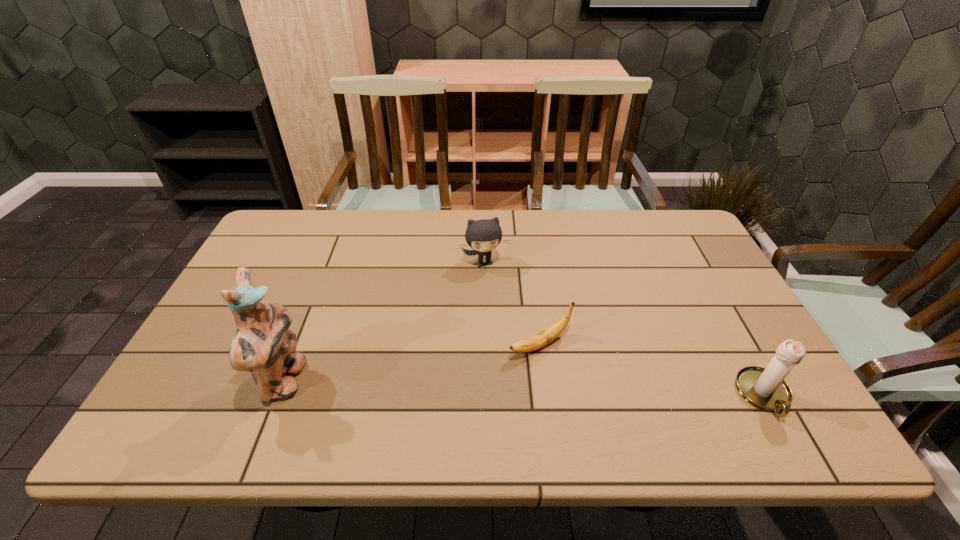
Identify the location of free space at the right edge of the desktop. (756, 340).

This screenshot has width=960, height=540. I want to click on vacant space at the far left corner of the desktop, so click(306, 219).

Where is `vacant space at the near left corner of the desktop`? This screenshot has width=960, height=540. vacant space at the near left corner of the desktop is located at coordinates (190, 402).

This screenshot has height=540, width=960. I want to click on vacant space at the far right corner of the desktop, so click(680, 242).

Find the location of `unoccupied area between the candle holder and the farthest object`. unoccupied area between the candle holder and the farthest object is located at coordinates [x=624, y=329].

The height and width of the screenshot is (540, 960). Find the location of `unoccupied area between the banana and the rightmost object`. unoccupied area between the banana and the rightmost object is located at coordinates (652, 370).

Identify the location of free space between the banana and the rightmost object. (652, 370).

The width and height of the screenshot is (960, 540). I want to click on vacant region between the farthest object and the candle holder, so click(624, 329).

Locate an element on the screen. unoccupied area between the figurine and the rightmost object is located at coordinates (524, 388).

This screenshot has width=960, height=540. I want to click on empty space between the figurine and the farthest object, so click(x=384, y=322).